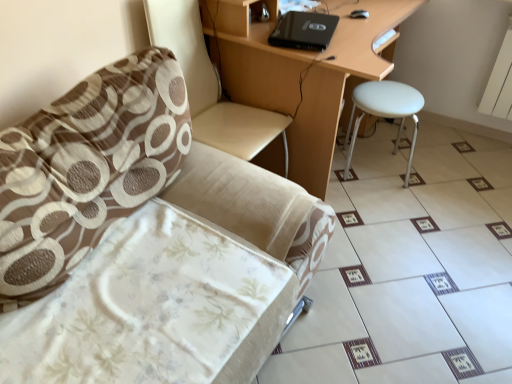
Question: Should I look upward or downward to see white matte stool at right?

Choices:
 (A) down
 (B) up

Answer: (B)

Question: Is black matte laptop at upper center to the left of beige fabric chair at left from the viewer's perspective?

Choices:
 (A) no
 (B) yes

Answer: (A)

Question: Can you confirm if black matte laptop at upper center is smaller than beige fabric chair at left?

Choices:
 (A) no
 (B) yes

Answer: (B)

Question: From the image's perspective, is black matte laptop at upper center located beneath beige fabric chair at left?

Choices:
 (A) no
 (B) yes

Answer: (A)

Question: Could you tell me if black matte laptop at upper center is facing beige fabric chair at left?

Choices:
 (A) no
 (B) yes

Answer: (A)

Question: Is black matte laptop at upper center at the right side of beige fabric chair at left?

Choices:
 (A) yes
 (B) no

Answer: (A)

Question: Can you confirm if black matte laptop at upper center is shorter than beige fabric chair at left?

Choices:
 (A) no
 (B) yes

Answer: (B)

Question: From the image's perspective, does white matte stool at right appear higher than beige fabric chair at left?

Choices:
 (A) yes
 (B) no

Answer: (A)

Question: Considering the relative positions of white matte stool at right and beige fabric chair at left in the image provided, is white matte stool at right to the right of beige fabric chair at left from the viewer's perspective?

Choices:
 (A) no
 (B) yes

Answer: (B)

Question: Is white matte stool at right completely or partially outside of beige fabric chair at left?

Choices:
 (A) no
 (B) yes

Answer: (B)

Question: Are white matte stool at right and beige fabric chair at left located far from each other?

Choices:
 (A) yes
 (B) no

Answer: (A)

Question: Does white matte stool at right have a larger size compared to beige fabric chair at left?

Choices:
 (A) yes
 (B) no

Answer: (B)

Question: Considering the relative sizes of white matte stool at right and beige fabric chair at left in the image provided, is white matte stool at right taller than beige fabric chair at left?

Choices:
 (A) yes
 (B) no

Answer: (B)

Question: Is beige fabric chair at left shorter than white glossy tile at lower right?

Choices:
 (A) yes
 (B) no

Answer: (B)